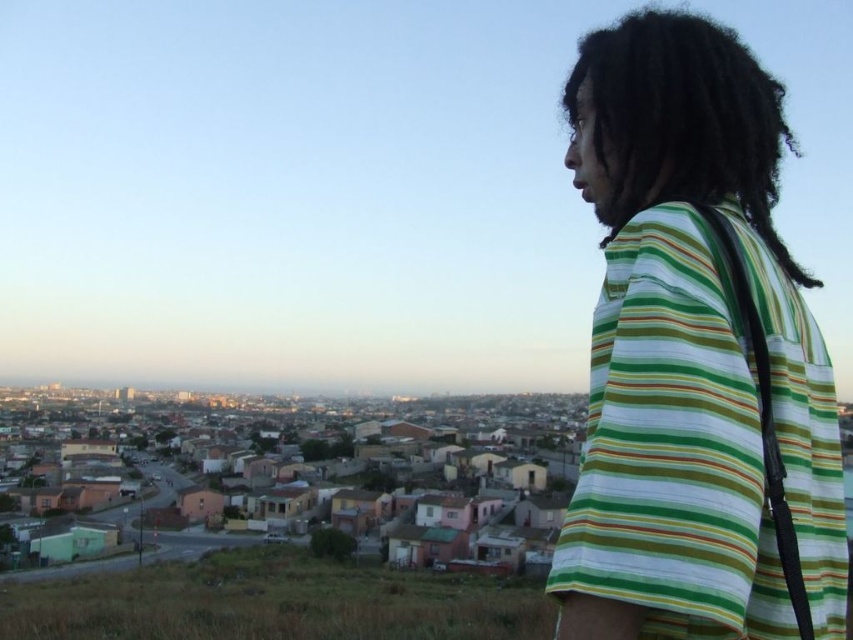
Question: Is green striped shirt at right further to the viewer compared to black curly hair at upper right?

Choices:
 (A) no
 (B) yes

Answer: (A)

Question: Which of the following is the farthest from the observer?

Choices:
 (A) (692, 374)
 (B) (640, 161)

Answer: (B)

Question: Does green striped shirt at right have a smaller size compared to black curly hair at upper right?

Choices:
 (A) no
 (B) yes

Answer: (A)

Question: Among these points, which one is farthest from the camera?

Choices:
 (A) (593, 451)
 (B) (769, 164)

Answer: (B)

Question: Is green striped shirt at right smaller than black curly hair at upper right?

Choices:
 (A) no
 (B) yes

Answer: (A)

Question: Which point is farther to the camera?

Choices:
 (A) (740, 81)
 (B) (610, 131)

Answer: (B)